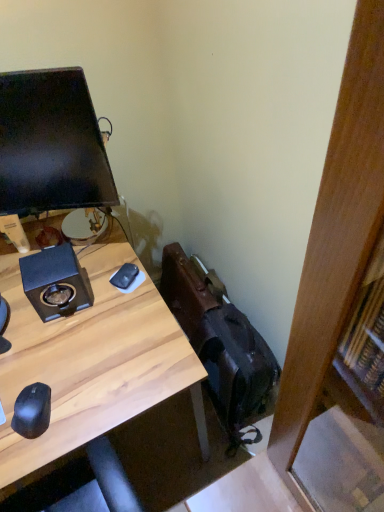
Image resolution: width=384 pixels, height=512 pixels. Find the location of `vacant area that is in front of black matte speaker at upper left`. vacant area that is in front of black matte speaker at upper left is located at coordinates (60, 353).